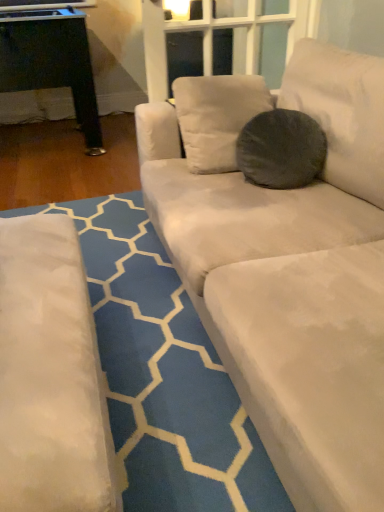
Where is `white fabric couch at lower right`? This screenshot has width=384, height=512. white fabric couch at lower right is located at coordinates (163, 374).

Describe the element at coordinates (163, 374) in the screenshot. I see `white fabric couch at lower right` at that location.

Describe the element at coordinates (281, 149) in the screenshot. The width and height of the screenshot is (384, 512). I see `dark gray fuzzy pillow at center` at that location.

Where is `dark gray fuzzy pillow at center`? dark gray fuzzy pillow at center is located at coordinates (281, 149).

The image size is (384, 512). Identify the location of white fabric couch at lower right. [x=163, y=374].

Does dark gray fuzzy pillow at center appear on the right side of white fabric couch at lower right?

Indeed, dark gray fuzzy pillow at center is positioned on the right side of white fabric couch at lower right.

Is dark gray fuzzy pillow at center behind white fabric couch at lower right?

Yes, it is behind white fabric couch at lower right.

Considering the points (244, 141) and (104, 351), which point is behind, point (244, 141) or point (104, 351)?

The point (244, 141) is more distant.

From the image's perspective, is dark gray fuzzy pillow at center on white fabric couch at lower right?

Correct, dark gray fuzzy pillow at center appears higher than white fabric couch at lower right in the image.

From a real-world perspective, does dark gray fuzzy pillow at center sit lower than white fabric couch at lower right?

No.

Considering the relative sizes of dark gray fuzzy pillow at center and white fabric couch at lower right in the image provided, is dark gray fuzzy pillow at center wider than white fabric couch at lower right?

No, dark gray fuzzy pillow at center is not wider than white fabric couch at lower right.

Can you confirm if dark gray fuzzy pillow at center is taller than white fabric couch at lower right?

Correct, dark gray fuzzy pillow at center is much taller as white fabric couch at lower right.

Based on their sizes in the image, would you say dark gray fuzzy pillow at center is bigger or smaller than white fabric couch at lower right?

Considering their sizes, dark gray fuzzy pillow at center takes up less space than white fabric couch at lower right.

Do you think dark gray fuzzy pillow at center is within white fabric couch at lower right, or outside of it?

dark gray fuzzy pillow at center is outside white fabric couch at lower right.

Is dark gray fuzzy pillow at center not close to white fabric couch at lower right?

No, there isn't a large distance between dark gray fuzzy pillow at center and white fabric couch at lower right.

Does dark gray fuzzy pillow at center turn towards white fabric couch at lower right?

No.

Consider the image. Can you tell me how much dark gray fuzzy pillow at center and white fabric couch at lower right differ in facing direction?

dark gray fuzzy pillow at center and white fabric couch at lower right are facing 117 degrees away from each other.

Find the location of a particular element. This screenshot has height=512, width=384. pattern beneath the dark gray fuzzy pillow at center (from a real-world perspective) is located at coordinates (163, 374).

Is white fabric couch at lower right to the left or to the right of dark gray fuzzy pillow at center in the image?

Clearly, white fabric couch at lower right is on the left of dark gray fuzzy pillow at center in the image.

Which object is closer to the camera, white fabric couch at lower right or dark gray fuzzy pillow at center?

white fabric couch at lower right is more forward.

Is point (111, 320) positioned in front of point (263, 147)?

Yes, it is in front of point (263, 147).

From the image's perspective, does white fabric couch at lower right appear lower than dark gray fuzzy pillow at center?

Indeed, from the image's perspective, white fabric couch at lower right is shown beneath dark gray fuzzy pillow at center.

From a real-world perspective, is white fabric couch at lower right above or below dark gray fuzzy pillow at center?

white fabric couch at lower right is situated lower than dark gray fuzzy pillow at center in the real world.

Between white fabric couch at lower right and dark gray fuzzy pillow at center, which one has larger width?

Wider between the two is white fabric couch at lower right.

From the picture: Can you confirm if white fabric couch at lower right is shorter than dark gray fuzzy pillow at center?

Yes, white fabric couch at lower right is shorter than dark gray fuzzy pillow at center.

Considering the relative sizes of white fabric couch at lower right and dark gray fuzzy pillow at center in the image provided, is white fabric couch at lower right bigger than dark gray fuzzy pillow at center?

Yes, white fabric couch at lower right is bigger than dark gray fuzzy pillow at center.

Is white fabric couch at lower right surrounding dark gray fuzzy pillow at center?

Actually, dark gray fuzzy pillow at center is outside white fabric couch at lower right.

Consider the image. Can you see white fabric couch at lower right touching dark gray fuzzy pillow at center?

No, white fabric couch at lower right is not beside dark gray fuzzy pillow at center.

Could you tell me if white fabric couch at lower right is facing dark gray fuzzy pillow at center?

No, white fabric couch at lower right is not facing towards dark gray fuzzy pillow at center.

How many degrees apart are the facing directions of white fabric couch at lower right and dark gray fuzzy pillow at center?

They differ by 117 degrees in their facing directions.

Locate an element on the screen. This screenshot has height=512, width=384. pattern on the left of dark gray fuzzy pillow at center is located at coordinates (163, 374).

In the image, there is a white fabric couch at lower right. Where is `throw pillow above it (from the image's perspective)`? This screenshot has width=384, height=512. throw pillow above it (from the image's perspective) is located at coordinates (281, 149).

I want to click on pattern below the dark gray fuzzy pillow at center (from a real-world perspective), so click(163, 374).